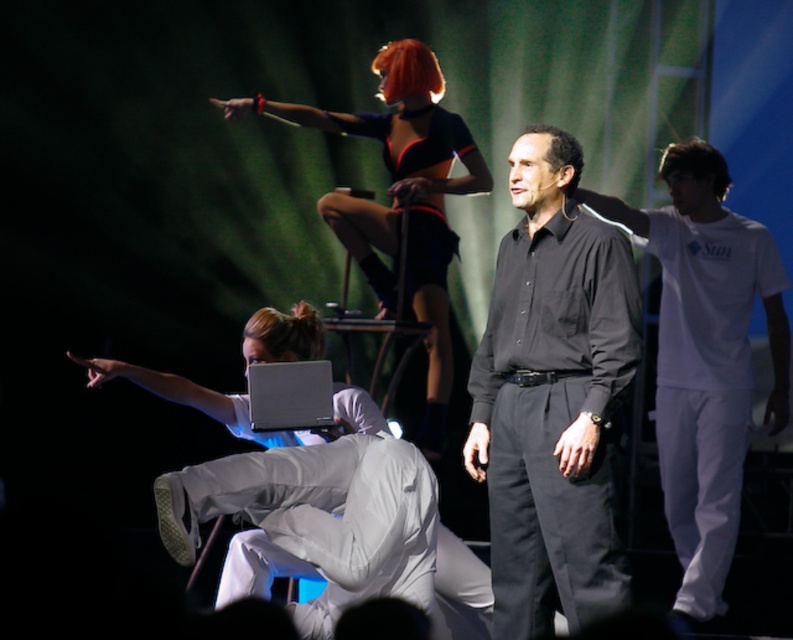
Does shiny black dress at upper center come behind white matte laptop at center?

Yes, shiny black dress at upper center is further from the viewer.

Find the location of a particular element. This screenshot has height=640, width=793. shiny black dress at upper center is located at coordinates (401, 198).

Can you confirm if white cotton t-shirt at right is positioned below white matte laptop at center?

Yes, white cotton t-shirt at right is below white matte laptop at center.

Locate an element on the screen. white cotton t-shirt at right is located at coordinates (705, 358).

How far apart are black smooth shirt at center and shiny black dress at upper center?

black smooth shirt at center and shiny black dress at upper center are 1.52 meters apart.

Which is in front, point (573, 442) or point (439, 307)?

Point (573, 442) is more forward.

Identify the location of black smooth shirt at center. (550, 396).